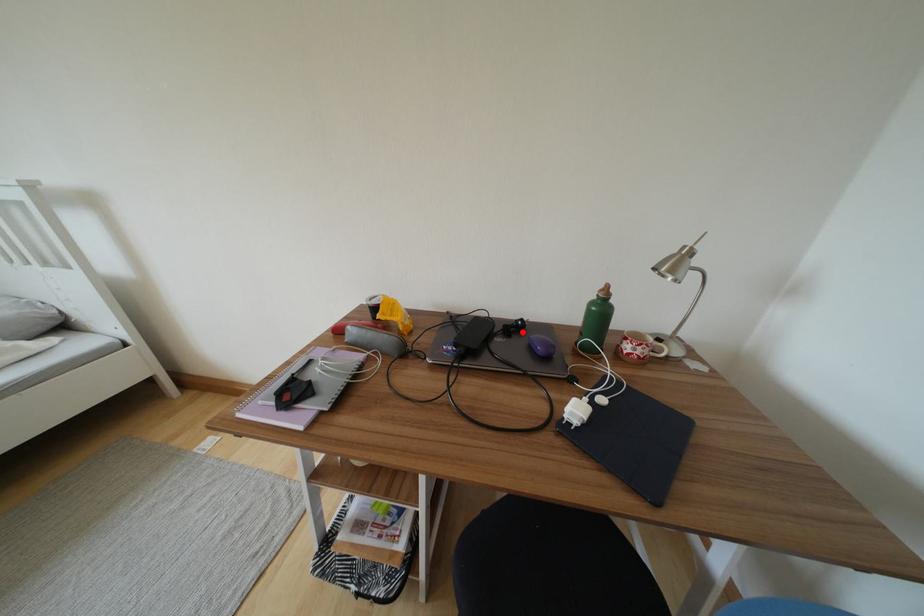
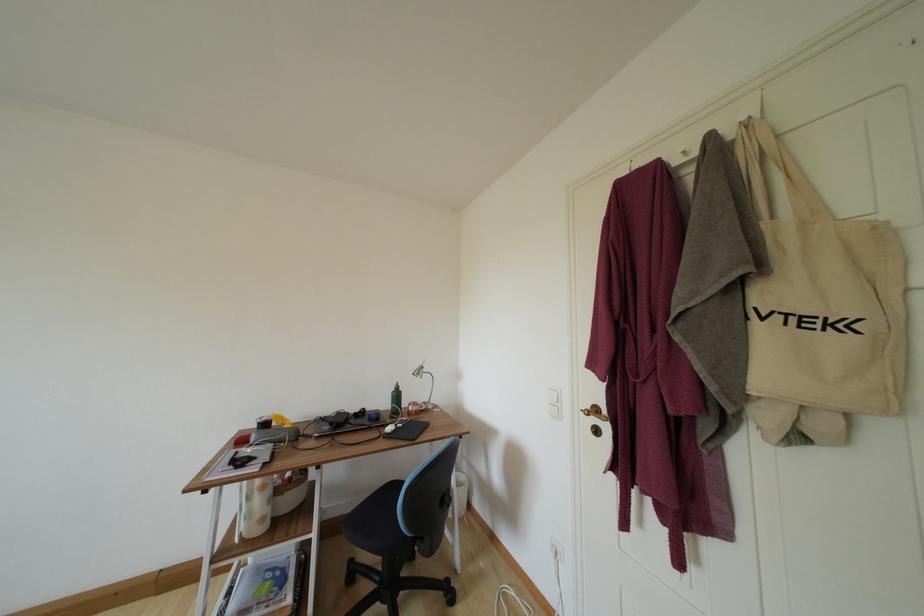
Question: I am providing you with two images of the same scene from different viewpoints. In image1, a red point is highlighted. Considering the same 3D point in image2, which of the following is correct?

Choices:
 (A) It is closer
 (B) It is farther

Answer: (B)